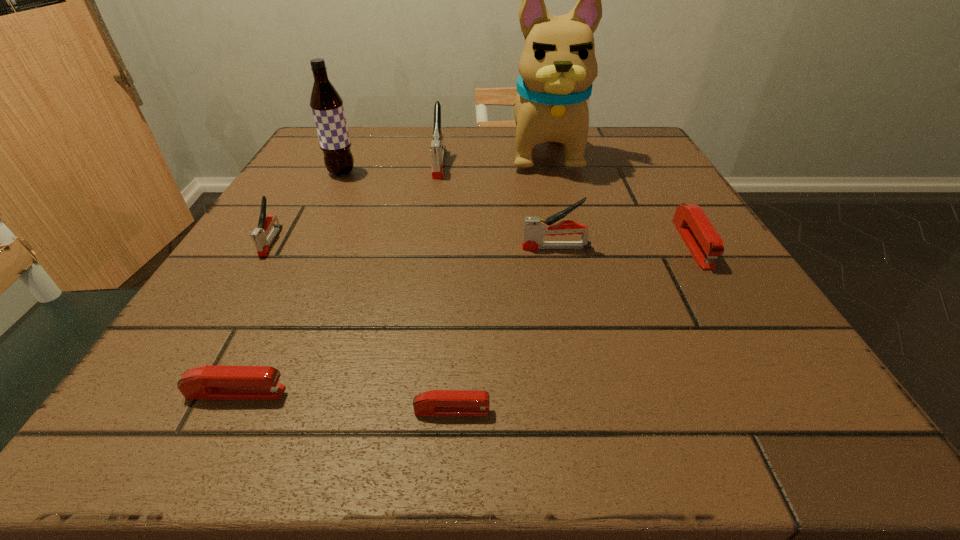
I want to click on free location located on the handle side of the rightmost gray stapler, so click(x=358, y=247).

Identify the location of vacant region located on the handle side of the rightmost gray stapler. Image resolution: width=960 pixels, height=540 pixels. (374, 247).

This screenshot has width=960, height=540. I want to click on blank space located 0.110m on the handle side of the leftmost gray stapler, so coord(235,301).

Image resolution: width=960 pixels, height=540 pixels. Identify the location of free location located 0.150m on the front-facing side of the sixth tallest object. (751, 340).

This screenshot has height=540, width=960. I want to click on vacant space located on the front-facing side of the leftmost red stapler, so click(380, 393).

This screenshot has height=540, width=960. I want to click on vacant space located 0.320m on the front-facing side of the nearest stapler, so click(755, 410).

Where is `puppy that is at the far edge`? puppy that is at the far edge is located at coordinates (557, 67).

Locate an element on the screen. The width and height of the screenshot is (960, 540). root beer at the far edge is located at coordinates (326, 104).

Identify the location of stapler that is at the far edge. The image size is (960, 540). (437, 148).

Image resolution: width=960 pixels, height=540 pixels. What are the coordinates of `root beer positioned at the left edge` in the screenshot? It's located at (326, 104).